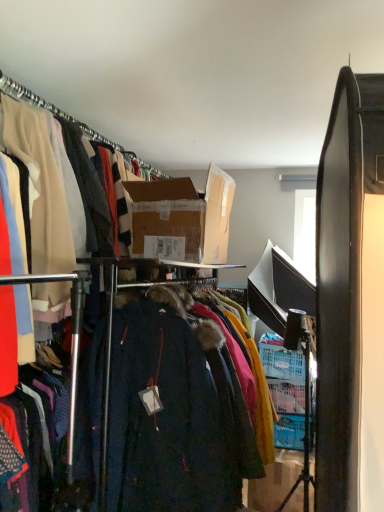
Question: Is cardboard box at center, arranged as the second box when viewed from the front, at the left side of velvet dark coat at center?

Choices:
 (A) no
 (B) yes

Answer: (A)

Question: Would you say velvet dark coat at center is part of cardboard box at center, placed as the 2th box when sorted from left to right,'s contents?

Choices:
 (A) no
 (B) yes

Answer: (A)

Question: Does cardboard box at center, arranged as the second box when viewed from the front, appear on the right side of velvet dark coat at center?

Choices:
 (A) yes
 (B) no

Answer: (A)

Question: Is the position of cardboard box at center, which is the 1th box from back to front, less distant than that of velvet dark coat at center?

Choices:
 (A) yes
 (B) no

Answer: (B)

Question: Considering the relative sizes of cardboard box at center, placed as the 2th box when sorted from left to right, and velvet dark coat at center in the image provided, is cardboard box at center, placed as the 2th box when sorted from left to right, smaller than velvet dark coat at center?

Choices:
 (A) no
 (B) yes

Answer: (B)

Question: Choose the correct answer: Is velvet dark coat at center inside brown cardboard box at center, the first box viewed from the front, or outside it?

Choices:
 (A) outside
 (B) inside

Answer: (A)

Question: From the image's perspective, is velvet dark coat at center above or below brown cardboard box at center, placed as the 1th box when sorted from top to bottom?

Choices:
 (A) below
 (B) above

Answer: (A)

Question: Is velvet dark coat at center in front of or behind brown cardboard box at center, placed as the 2th box when sorted from back to front, in the image?

Choices:
 (A) front
 (B) behind

Answer: (A)

Question: Considering the positions of velvet dark coat at center and brown cardboard box at center, which ranks as the 2th box in right-to-left order, in the image, is velvet dark coat at center wider or thinner than brown cardboard box at center, which ranks as the 2th box in right-to-left order,?

Choices:
 (A) thin
 (B) wide

Answer: (A)

Question: In terms of width, does cardboard box at center, placed as the 2th box when sorted from left to right, look wider or thinner when compared to brown cardboard box at center, which is the first box from left to right?

Choices:
 (A) wide
 (B) thin

Answer: (A)

Question: Is cardboard box at center, which ranks as the 1th box in bottom-to-top order, situated inside brown cardboard box at center, the first box viewed from the front, or outside?

Choices:
 (A) outside
 (B) inside

Answer: (A)

Question: From the image's perspective, is cardboard box at center, acting as the first box starting from the right, positioned above or below brown cardboard box at center, which is the first box from left to right?

Choices:
 (A) below
 (B) above

Answer: (A)

Question: Is cardboard box at center, which ranks as the 1th box in bottom-to-top order, bigger or smaller than brown cardboard box at center, which is the first box from left to right?

Choices:
 (A) small
 (B) big

Answer: (A)

Question: From a real-world perspective, is brown cardboard box at center, placed as the 2th box when sorted from back to front, positioned above or below velvet dark coat at center?

Choices:
 (A) below
 (B) above

Answer: (B)

Question: Considering the relative positions of brown cardboard box at center, placed as the 2th box when sorted from bottom to top, and velvet dark coat at center in the image provided, is brown cardboard box at center, placed as the 2th box when sorted from bottom to top, to the left or to the right of velvet dark coat at center?

Choices:
 (A) left
 (B) right

Answer: (A)